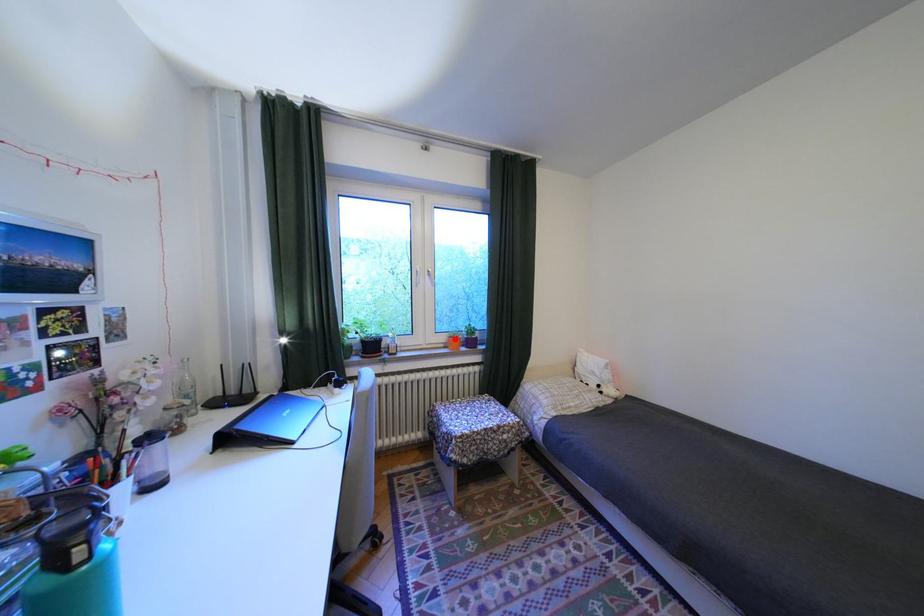
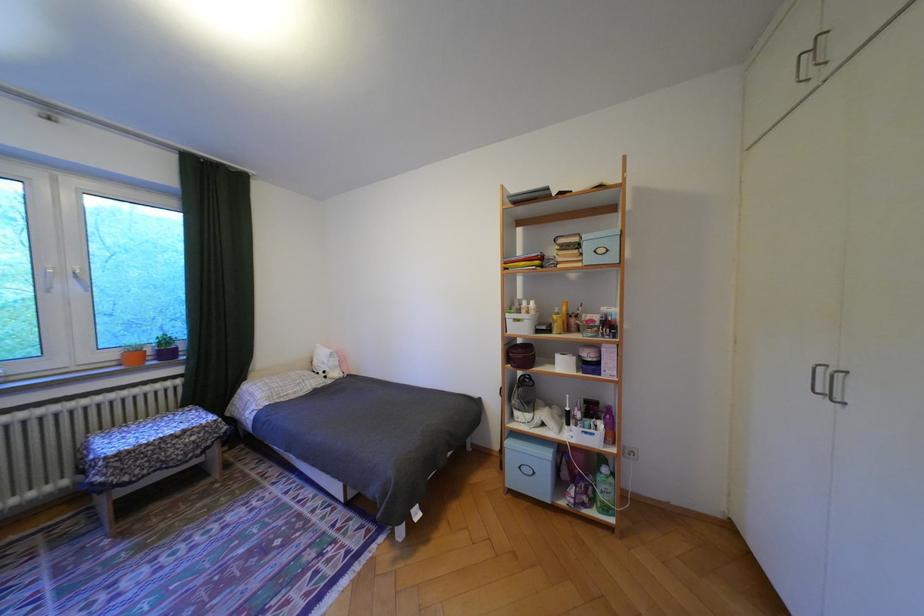
The point at the highlighted location is marked in the first image. Where is the corresponding point in the second image?

(124, 355)